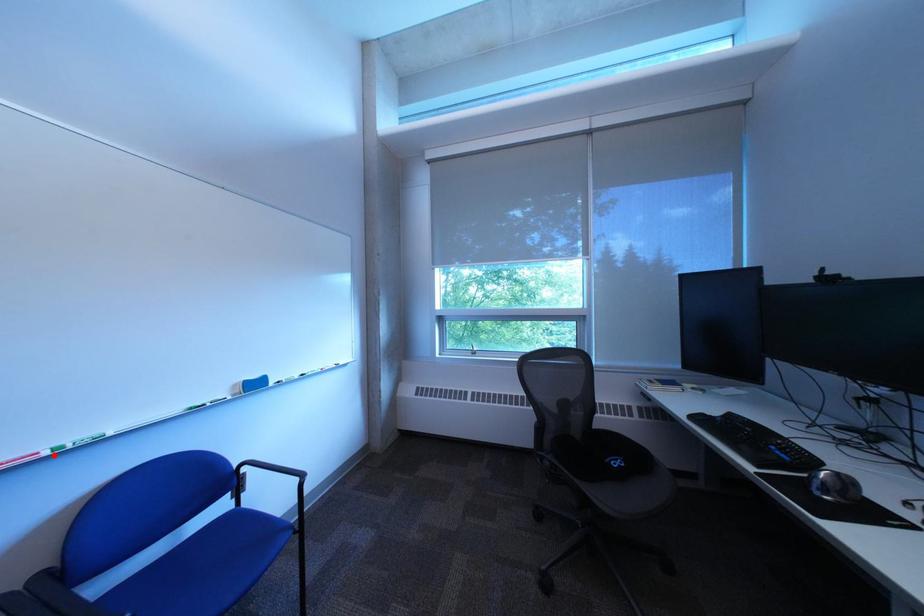
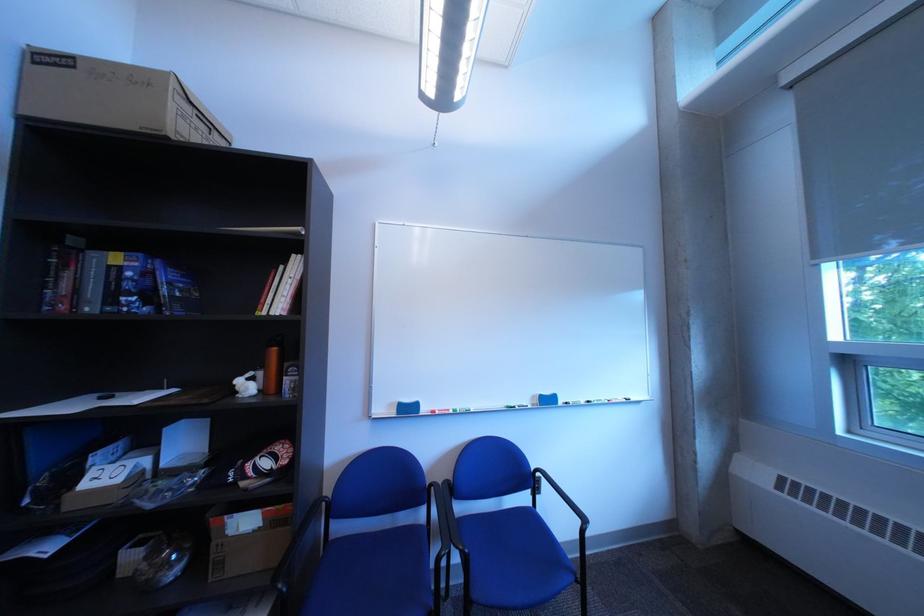
Find the pixel in the second image that matches the highlighted location in the first image.

(465, 411)